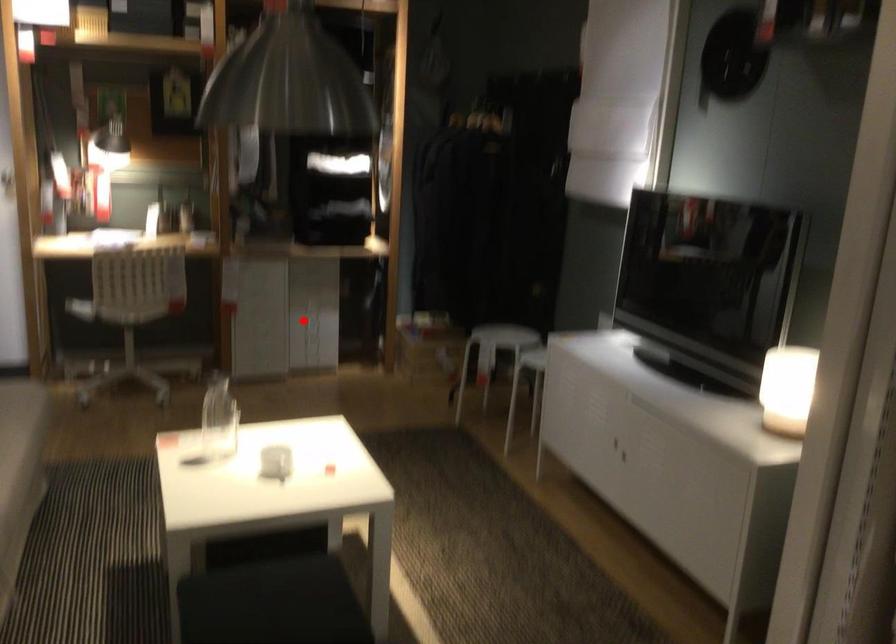
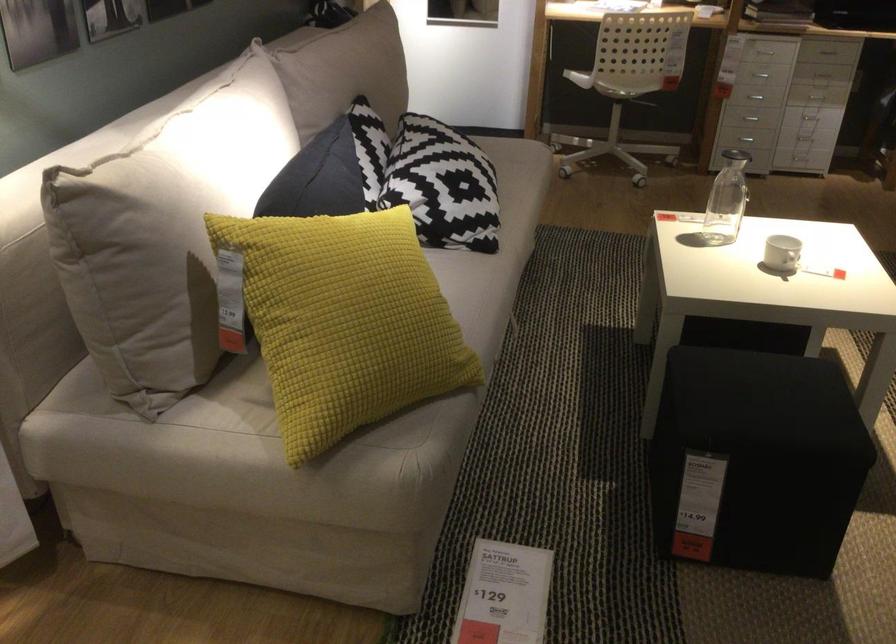
Question: I am providing you with two images of the same scene from different viewpoints. A red point is marked on the first image. Is the red point's position out of view in image 2?

Choices:
 (A) Yes
 (B) No

Answer: (B)